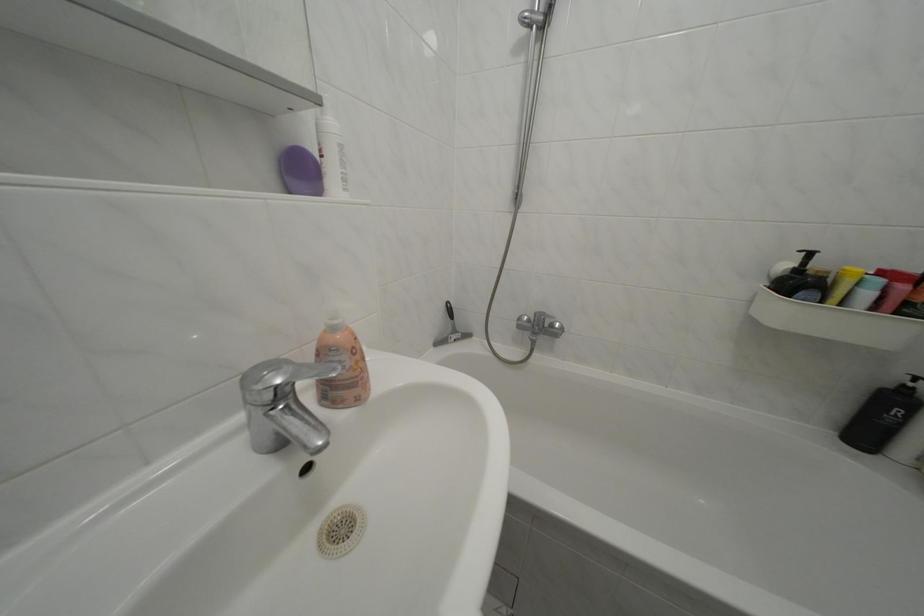
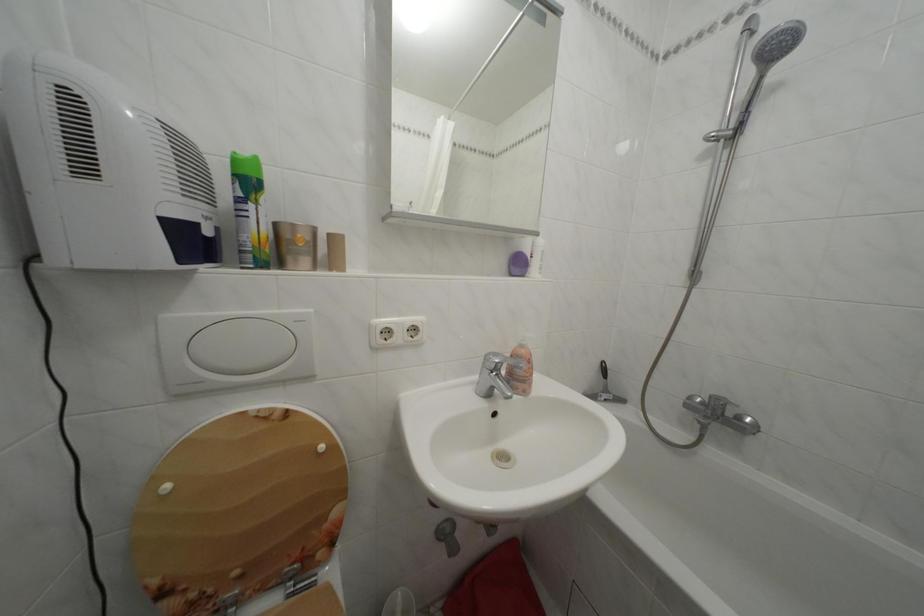
The point at (252, 384) is marked in the first image. Where is the corresponding point in the second image?

(495, 362)